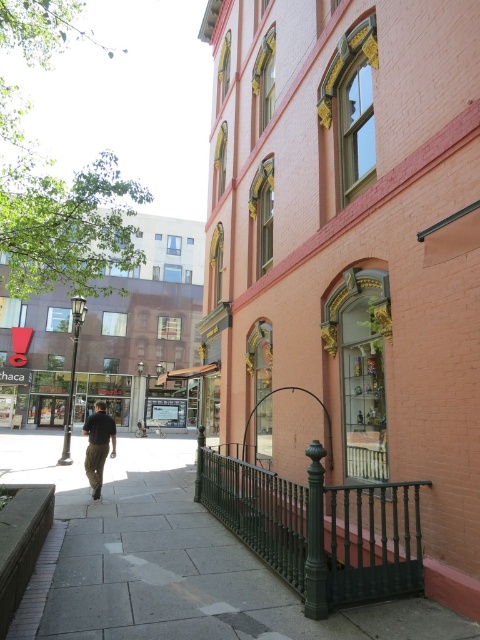
Who is lower down, gray concrete sidewalk at lower left or dark brown pants at center?

dark brown pants at center

Between gray concrete sidewalk at lower left and dark brown pants at center, which one has more height?

Standing taller between the two is dark brown pants at center.

Locate an element on the screen. gray concrete sidewalk at lower left is located at coordinates (169, 561).